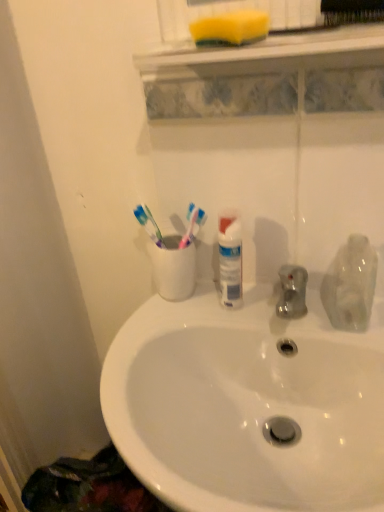
This screenshot has width=384, height=512. What do you see at coordinates (324, 14) in the screenshot?
I see `black bristle brush at upper center` at bounding box center [324, 14].

What do you see at coordinates (248, 403) in the screenshot? Image resolution: width=384 pixels, height=512 pixels. I see `white glossy sink at center` at bounding box center [248, 403].

At what (x,y) coordinates should I click in order to perform the action: click on black bristle brush at upper center. Please return your answer as a coordinate pair (x, y). The height and width of the screenshot is (512, 384). Looking at the image, I should click on (324, 14).

Is yellow sponge at upper center at the back of black bristle brush at upper center?

No.

How much distance is there between black bristle brush at upper center and yellow sponge at upper center?

The distance of black bristle brush at upper center from yellow sponge at upper center is 3.34 inches.

What are the coordinates of `brush in front of the yellow sponge at upper center` in the screenshot? It's located at (324, 14).

From the image's perspective, between black bristle brush at upper center and yellow sponge at upper center, which one is located above?

black bristle brush at upper center appears higher in the image.

How many degrees apart are the facing directions of black bristle brush at upper center and yellow sponge at upper center?

0.00606 degrees separate the facing orientations of black bristle brush at upper center and yellow sponge at upper center.

Is yellow sponge at upper center surrounded by black bristle brush at upper center?

No, yellow sponge at upper center is not a part of black bristle brush at upper center.

Does black bristle brush at upper center have a lesser height compared to yellow sponge at upper center?

In fact, black bristle brush at upper center may be taller than yellow sponge at upper center.

Is black bristle brush at upper center touching yellow sponge at upper center?

Indeed, black bristle brush at upper center and yellow sponge at upper center are beside each other and touching.

From a real-world perspective, between transparent plastic bottle at right and yellow sponge at upper center, who is vertically lower?

From a 3D spatial view, transparent plastic bottle at right is below.

Choose the correct answer: Is transparent plastic bottle at right inside yellow sponge at upper center or outside it?

The correct answer is: outside.

Which of these two, transparent plastic bottle at right or yellow sponge at upper center, is smaller?

Smaller between the two is transparent plastic bottle at right.

Can you see transparent plastic bottle at right touching yellow sponge at upper center?

transparent plastic bottle at right is not next to yellow sponge at upper center, and they're not touching.

Could you tell me if yellow sponge at upper center is turned towards white glossy sink at center?

No, yellow sponge at upper center is not facing towards white glossy sink at center.

Locate an element on the screen. The height and width of the screenshot is (512, 384). sink that is in front of the yellow sponge at upper center is located at coordinates pos(248,403).

Which object is more forward, yellow sponge at upper center or white glossy sink at center?

white glossy sink at center is closer to the camera.

Is yellow sponge at upper center aimed at transparent plastic bottle at right?

No, yellow sponge at upper center is not aimed at transparent plastic bottle at right.

You are a GUI agent. You are given a task and a screenshot of the screen. Output one action in this format:
    pyautogui.click(x=<x>, y=<y>)
    Task: Click on the soap above the transparent plastic bottle at right (from a real-world perspective)
    
    Given the screenshot: What is the action you would take?
    pyautogui.click(x=230, y=28)

Considering the relative positions of yellow sponge at upper center and transparent plastic bottle at right in the image provided, is yellow sponge at upper center in front of transparent plastic bottle at right?

That is True.

In the scene shown: From the image's perspective, relative to transparent plastic bottle at right, is yellow sponge at upper center above or below?

From the image's perspective, yellow sponge at upper center appears above transparent plastic bottle at right.

Considering the points (310, 16) and (356, 321), which point is behind, point (310, 16) or point (356, 321)?

The point (356, 321) is farther from the camera.

In terms of size, does black bristle brush at upper center appear bigger or smaller than transparent plastic bottle at right?

In the image, black bristle brush at upper center appears to be smaller than transparent plastic bottle at right.

In the scene shown: From the image's perspective, is black bristle brush at upper center beneath transparent plastic bottle at right?

No, from the image's perspective, black bristle brush at upper center is not beneath transparent plastic bottle at right.

How many degrees apart are the facing directions of black bristle brush at upper center and transparent plastic bottle at right?

0.603 degrees separate the facing orientations of black bristle brush at upper center and transparent plastic bottle at right.

Is point (244, 49) in front of point (308, 24)?

That is True.

Is yellow sponge at upper center wider or thinner than black bristle brush at upper center?

Clearly, yellow sponge at upper center has more width compared to black bristle brush at upper center.

Is yellow sponge at upper center completely or partially outside of black bristle brush at upper center?

yellow sponge at upper center lies outside black bristle brush at upper center's area.

This screenshot has width=384, height=512. In order to click on brush above the yellow sponge at upper center (from the image's perspective) in this screenshot , I will do `click(324, 14)`.

Find the location of a particular element. brush above the yellow sponge at upper center (from a real-world perspective) is located at coordinates (324, 14).

Which object lies further to the anchor point yellow sponge at upper center, black bristle brush at upper center or transparent plastic bottle at right?

Based on the image, transparent plastic bottle at right appears to be further to yellow sponge at upper center.

Which object lies further to the anchor point yellow sponge at upper center, transparent plastic bottle at right or white glossy sink at center?

Among the two, white glossy sink at center is located further to yellow sponge at upper center.

Considering their positions, is black bristle brush at upper center positioned closer to transparent plastic bottle at right than yellow sponge at upper center?

Based on the image, black bristle brush at upper center appears to be nearer to transparent plastic bottle at right.

Based on their spatial positions, is yellow sponge at upper center or black bristle brush at upper center closer to white glossy sink at center?

Based on the image, yellow sponge at upper center appears to be nearer to white glossy sink at center.

When comparing their distances from white glossy sink at center, does transparent plastic bottle at right or yellow sponge at upper center seem closer?

Based on the image, transparent plastic bottle at right appears to be nearer to white glossy sink at center.

Estimate the real-world distances between objects in this image. Which object is closer to yellow sponge at upper center, yellow sponge at upper center or black bristle brush at upper center?

Among the two, yellow sponge at upper center is located nearer to yellow sponge at upper center.

Looking at the image, which one is located closer to transparent plastic bottle at right, black bristle brush at upper center or yellow sponge at upper center?

Based on the image, yellow sponge at upper center appears to be nearer to transparent plastic bottle at right.

Considering their positions, is transparent plastic bottle at right positioned further to white glossy sink at center than yellow sponge at upper center?

yellow sponge at upper center.

This screenshot has width=384, height=512. Identify the location of window sill between yellow sponge at upper center and transparent plastic bottle at right in the up-down direction. (272, 53).

This screenshot has width=384, height=512. I want to click on window sill between black bristle brush at upper center and transparent plastic bottle at right in the up-down direction, so click(x=272, y=53).

I want to click on soap between black bristle brush at upper center and white glossy sink at center from top to bottom, so click(230, 28).

The width and height of the screenshot is (384, 512). I want to click on cleaning product between black bristle brush at upper center and white glossy sink at center in the up-down direction, so click(x=351, y=285).